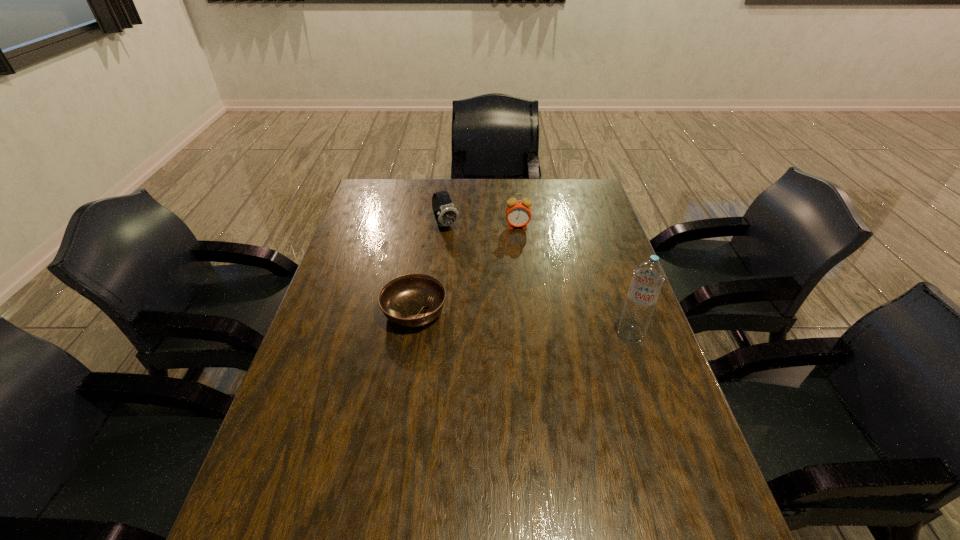
At what (x,y) coordinates should I click in order to perform the action: click on the shortest object. Please return your answer as a coordinate pair (x, y). This screenshot has width=960, height=540. Looking at the image, I should click on (412, 300).

This screenshot has height=540, width=960. I want to click on the rightmost object, so click(648, 276).

Where is `the tallest object`? the tallest object is located at coordinates (648, 276).

Locate an element on the screen. This screenshot has width=960, height=540. watch is located at coordinates (446, 214).

Where is `the third object from left to right`? the third object from left to right is located at coordinates (518, 213).

Find the location of a particular element. This screenshot has width=960, height=540. vacant space located on the back of the shortest object is located at coordinates (428, 225).

Locate an element on the screen. This screenshot has width=960, height=540. vacant region located 0.180m on the left of the rightmost object is located at coordinates (549, 334).

The width and height of the screenshot is (960, 540). I want to click on free spot located 0.340m on the face of the watch, so click(493, 296).

Identify the location of blank space located on the face of the watch. (492, 294).

Where is `free space located on the face of the watch`? The image size is (960, 540). free space located on the face of the watch is located at coordinates (467, 258).